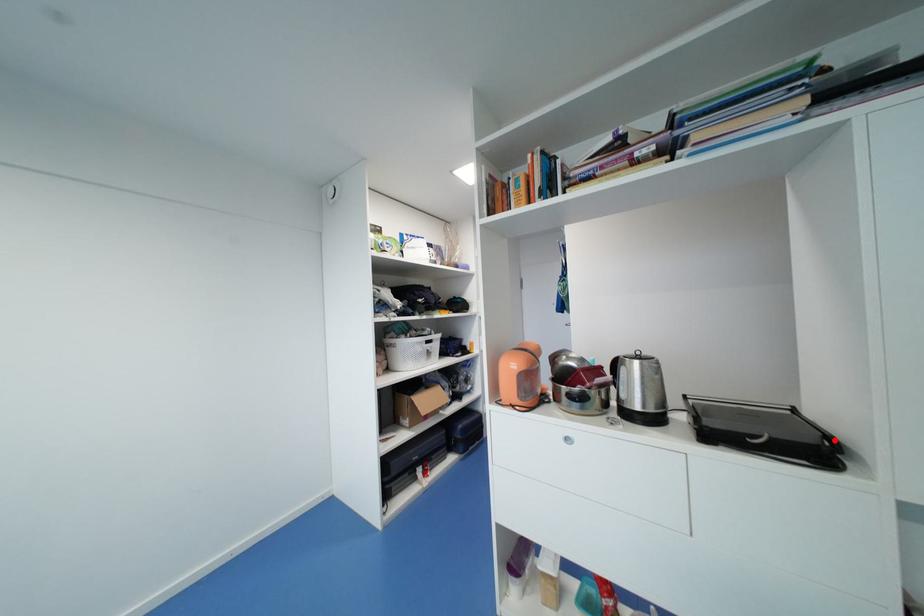
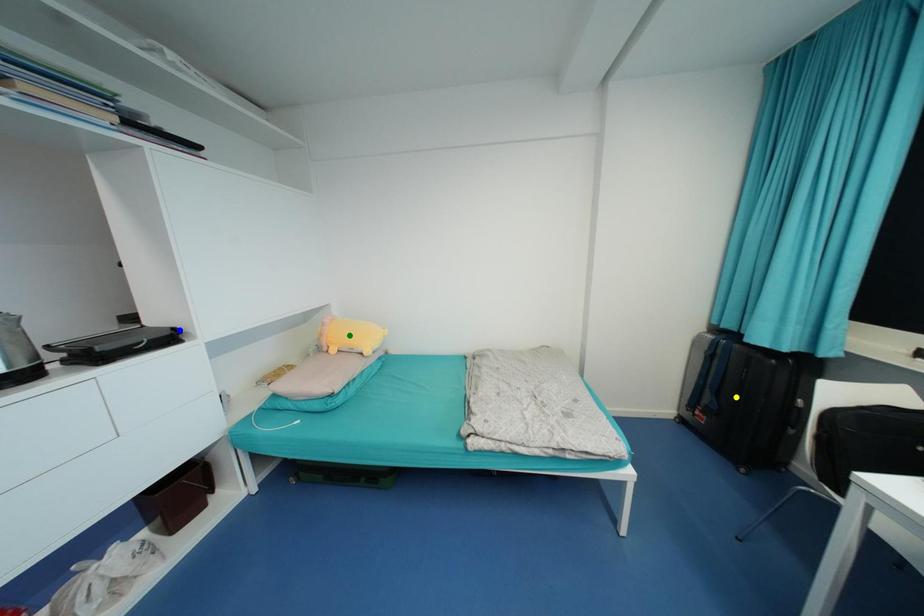
Question: I am providing you with two images of the same scene from different viewpoints. A red point is marked on the first image. You are given multiple points on the second image. Can you choose the point in image 2 that corresponds to the point in image 1?

Choices:
 (A) blue point
 (B) green point
 (C) yellow point

Answer: (A)